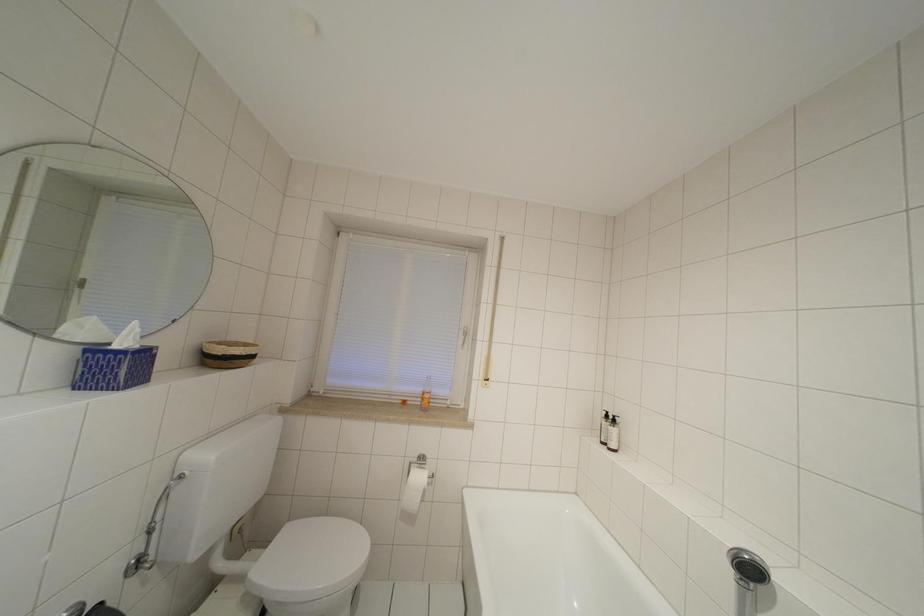
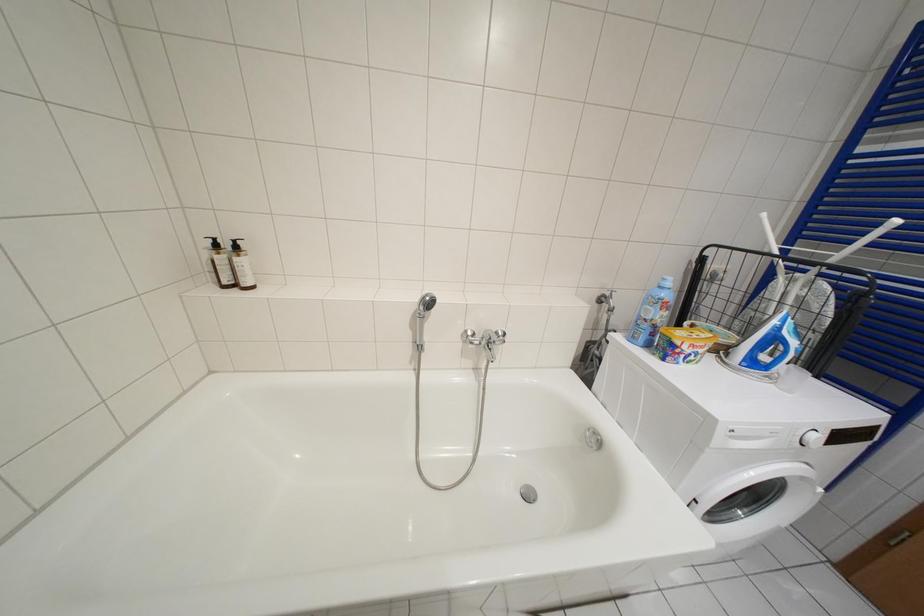
The images are taken continuously from a first-person perspective. In which direction is your viewpoint rotating?

The camera rotated toward right-down.